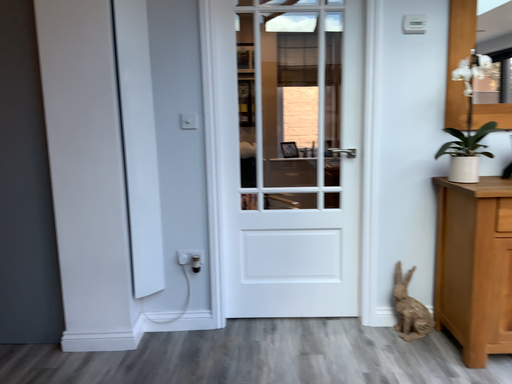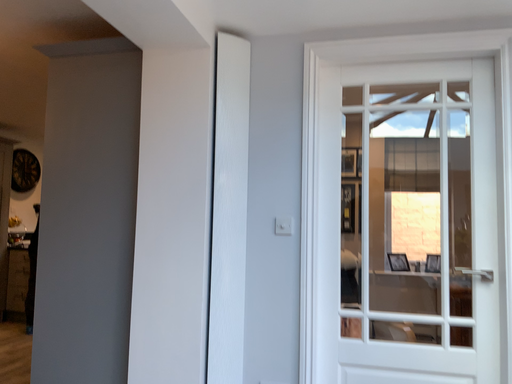
Question: How did the camera likely rotate when shooting the video?

Choices:
 (A) rotated right
 (B) rotated left

Answer: (B)